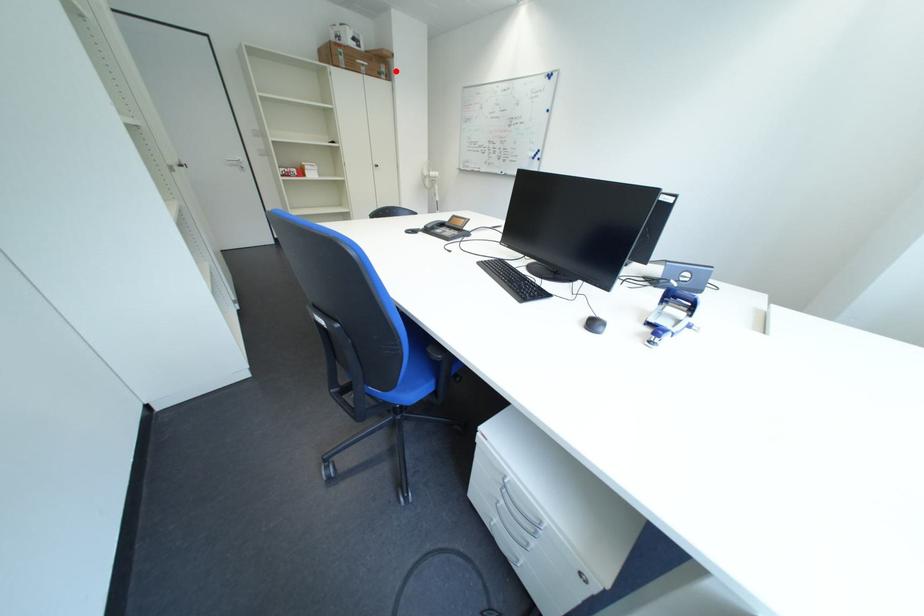
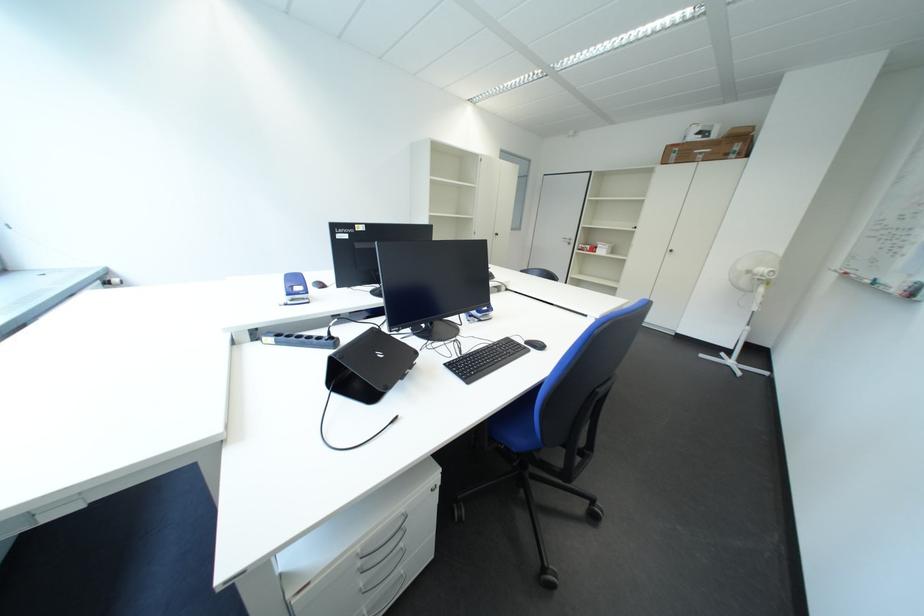
Question: I am providing you with two images of the same scene from different viewpoints. Given a red point in image1, look at the same physical point in image2. Is it:

Choices:
 (A) Closer to the viewpoint
 (B) Farther from the viewpoint

Answer: (B)